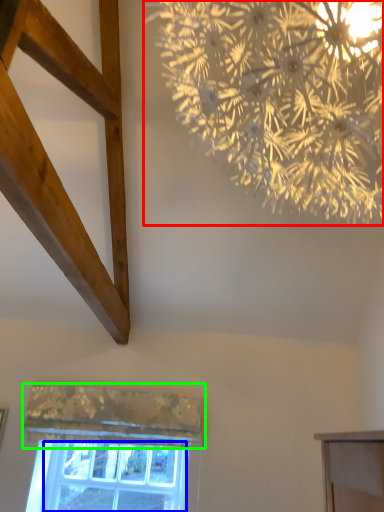
Question: Estimate the real-world distances between objects in this image. Which object is farther from flower (highlighted by a red box), window screen (highlighted by a blue box) or curtain (highlighted by a green box)?

Choices:
 (A) window screen
 (B) curtain

Answer: (A)